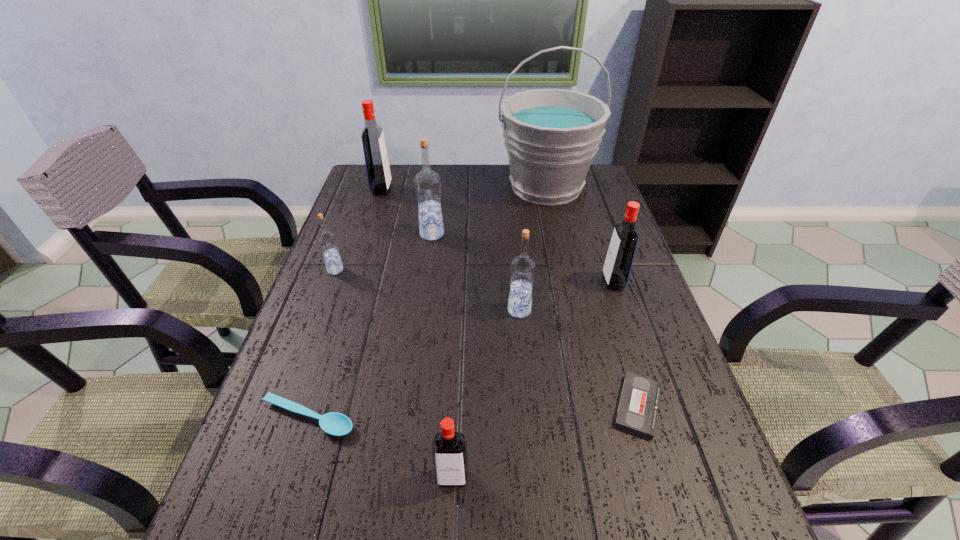
The image size is (960, 540). What are the coordinates of `vacant region located 0.340m on the front and back of the rightmost vodka` in the screenshot? It's located at (474, 282).

Find the location of a particular element. This screenshot has height=540, width=960. vacant space located on the front and back of the rightmost vodka is located at coordinates (562, 282).

Where is `free spot located on the back of the rightmost blue vodka`? This screenshot has height=540, width=960. free spot located on the back of the rightmost blue vodka is located at coordinates (x=516, y=265).

At what (x,y) coordinates should I click in order to perform the action: click on vacant region located 0.100m on the back of the leftmost blue vodka. Please return your answer as a coordinate pair (x, y). Image resolution: width=960 pixels, height=540 pixels. Looking at the image, I should click on (346, 242).

The height and width of the screenshot is (540, 960). I want to click on vacant area situated on the front and back of the second red vodka from right to left, so click(x=450, y=519).

You are a GUI agent. You are given a task and a screenshot of the screen. Output one action in this format:
    pyautogui.click(x=<x>, y=<y>)
    Task: Click on the free space located on the back of the spoon
    
    Given the screenshot: What is the action you would take?
    pyautogui.click(x=354, y=274)

I want to click on free space located on the left of the videotape, so click(x=545, y=406).

Identify the location of bucket positioned at the far edge. The width and height of the screenshot is (960, 540). (551, 136).

Where is `vodka at the far edge`? vodka at the far edge is located at coordinates (376, 160).

The height and width of the screenshot is (540, 960). Find the location of `spoon at the left edge`. spoon at the left edge is located at coordinates (336, 424).